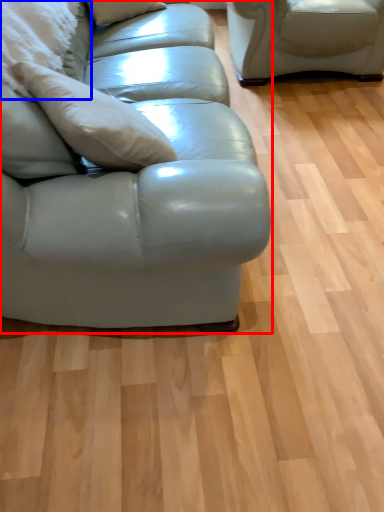
Question: Among these objects, which one is nearest to the camera, studio couch (highlighted by a red box) or pillow (highlighted by a blue box)?

Choices:
 (A) studio couch
 (B) pillow

Answer: (A)